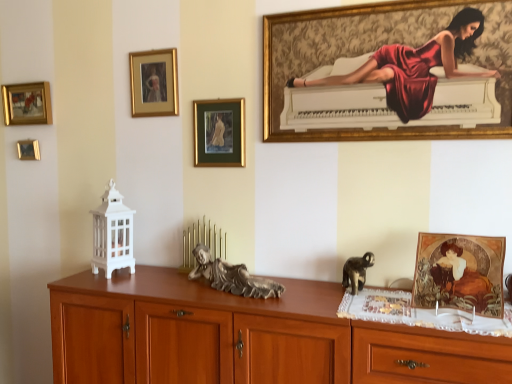
Question: From their relative heights in the image, would you say wooden drawer at lower right is taller or shorter than brown wooden chest of drawers at center?

Choices:
 (A) short
 (B) tall

Answer: (A)

Question: Is wooden drawer at lower right wider or thinner than brown wooden chest of drawers at center?

Choices:
 (A) thin
 (B) wide

Answer: (A)

Question: Which is farther from the wooden drawer at lower right?

Choices:
 (A) metallic gold picture frame at upper left, which is counted as the fifth picture frame, starting from the right
 (B) gold-framed painting at upper center, arranged as the 1th picture frame when viewed from the front
 (C) gold-framed painting at upper left, marked as the 4th picture frame in a front-to-back arrangement
 (D) brown wooden chest of drawers at center
 (E) silver metallic statue at center, the 2th animal in the right-to-left sequence

Answer: (A)

Question: Based on their relative distances, which object is nearer to the brown wooden chest of drawers at center?

Choices:
 (A) gold-framed painting at upper center, acting as the 1th picture frame starting from the right
 (B) gold-framed painting at upper left, marked as the 4th picture frame in a front-to-back arrangement
 (C) wooden drawer at lower right
 (D) gold/glossy picture frame at upper left, which is the 3th picture frame in right-to-left order
 (E) silver metallic statue at center, positioned as the first animal in left-to-right order

Answer: (E)